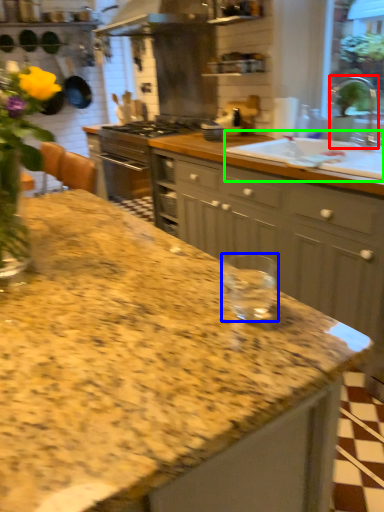
Question: Which object is positioned closest to faucet (highlighted by a red box)? Select from glass jar (highlighted by a blue box) and sink (highlighted by a green box).

Choices:
 (A) glass jar
 (B) sink

Answer: (B)